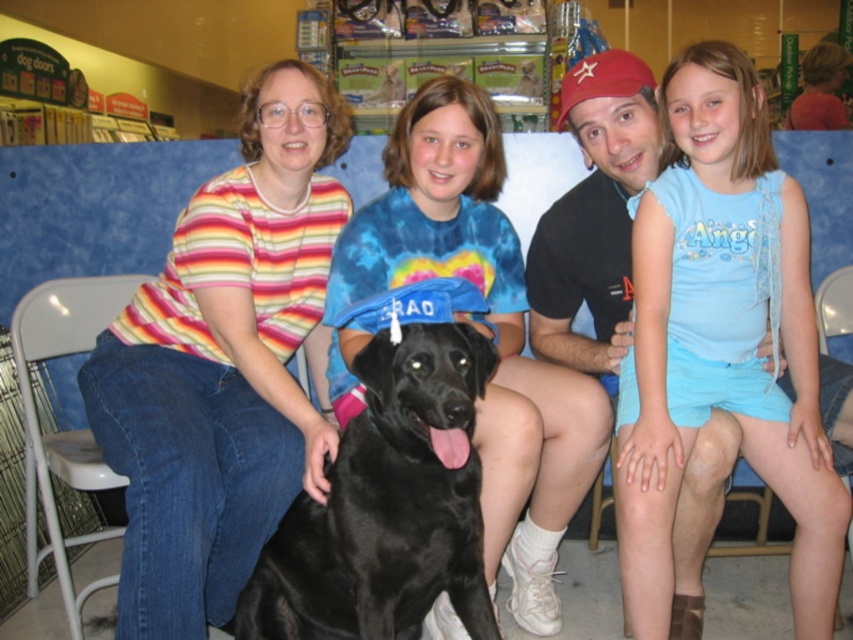
Which of these two, tie-dye fabric shirt at center or black matte dog at center, stands taller?

tie-dye fabric shirt at center

Image resolution: width=853 pixels, height=640 pixels. What do you see at coordinates (480, 328) in the screenshot?
I see `tie-dye fabric shirt at center` at bounding box center [480, 328].

Consider the image. Who is more distant from viewer, (498,404) or (445,406)?

The point (498,404) is more distant.

Image resolution: width=853 pixels, height=640 pixels. Find the location of `tie-dye fabric shirt at center`. tie-dye fabric shirt at center is located at coordinates (480, 328).

Does tie-dye fabric shirt at center appear over white plastic chair at lower left?

Yes, tie-dye fabric shirt at center is above white plastic chair at lower left.

Looking at this image, can you confirm if tie-dye fabric shirt at center is taller than white plastic chair at lower left?

Correct, tie-dye fabric shirt at center is much taller as white plastic chair at lower left.

Does point (595, 385) come in front of point (136, 275)?

Yes, it is.

Find the location of `tie-dye fabric shirt at center`. tie-dye fabric shirt at center is located at coordinates click(x=480, y=328).

Who is higher up, black matte dog at center or white plastic chair at lower left?

white plastic chair at lower left

How far apart are black matte dog at center and white plastic chair at lower left?

black matte dog at center is 26.18 inches from white plastic chair at lower left.

Image resolution: width=853 pixels, height=640 pixels. What are the coordinates of `black matte dog at center` in the screenshot? It's located at [x=387, y=506].